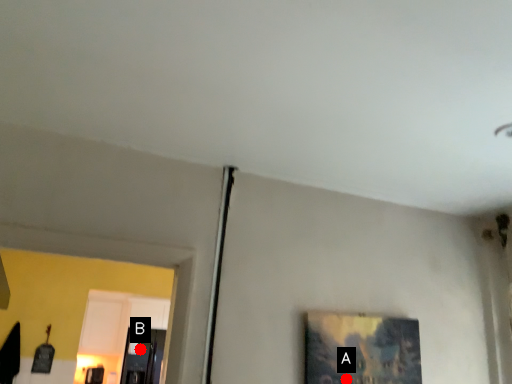
Question: Two points are circled on the image, labeled by A and B beside each circle. Which point is closer to the camera taking this photo?

Choices:
 (A) A is closer
 (B) B is closer

Answer: (A)